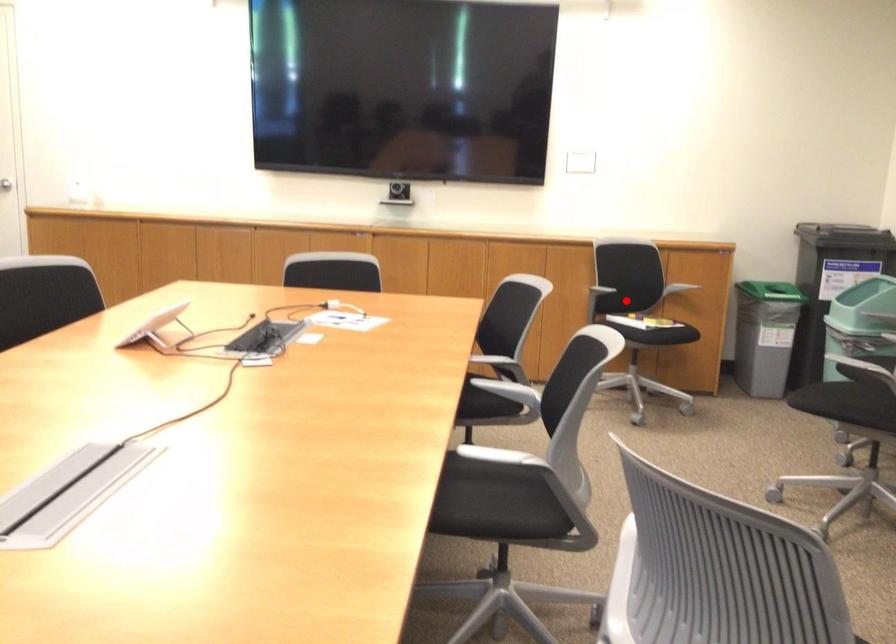
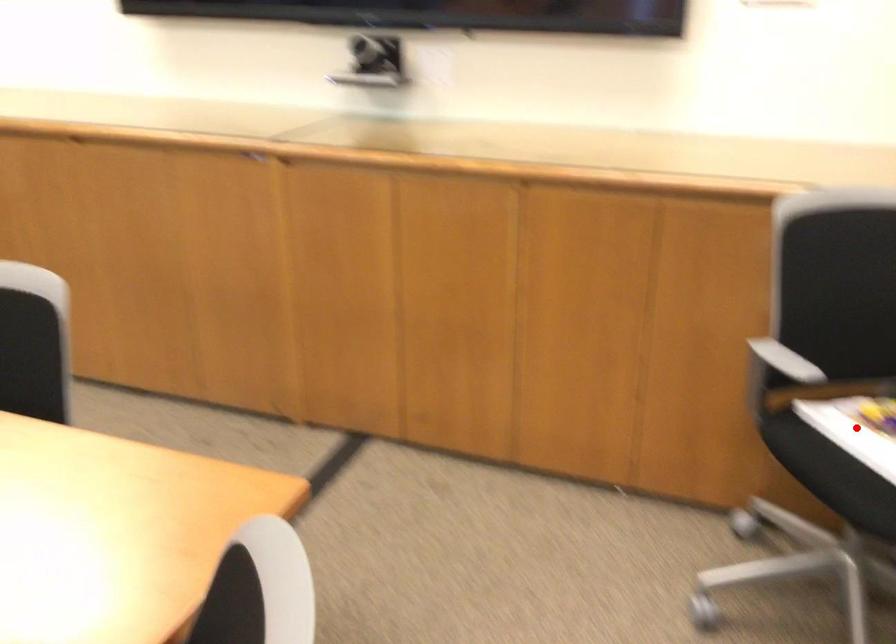
I am providing you with two images of the same scene from different viewpoints. A red point is marked on the first image and another point is marked on the second image. Are the points marked in image1 and image2 representing the same 3D position?

Yes